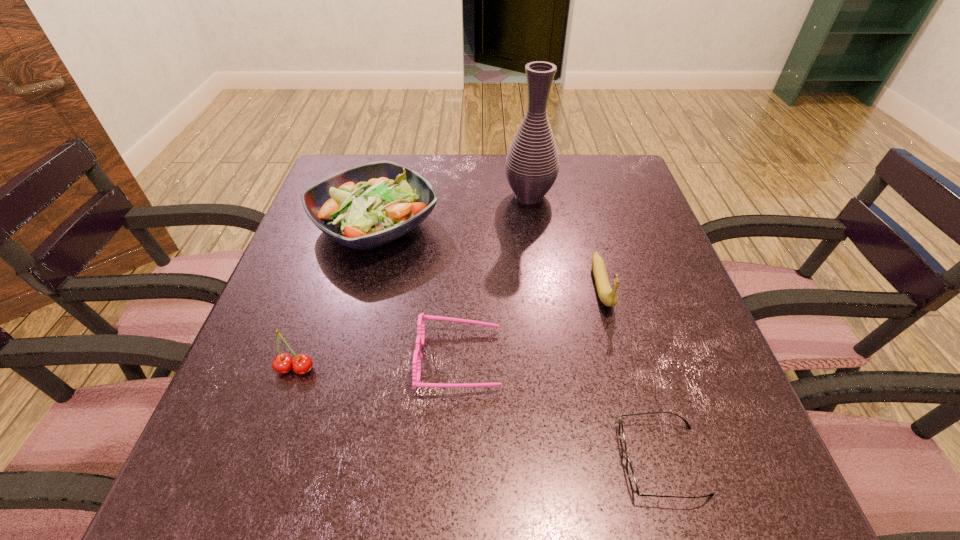
You are a GUI agent. You are given a task and a screenshot of the screen. Output one action in this format:
    pyautogui.click(x=<x>, y=<y>)
    Task: Click on the free space located 0.370m on the front of the salad plate
    Image resolution: width=960 pixels, height=540 pixels.
    Given the screenshot: What is the action you would take?
    pyautogui.click(x=319, y=434)

Identify the location of vacant area situated 0.300m at the stem of the banana. This screenshot has width=960, height=540. (652, 471).

Image resolution: width=960 pixels, height=540 pixels. I want to click on vacant region located with the stems of the cherry pointing upwards, so click(x=267, y=452).

Where is `free region located on the arms of the left spectacles`? The image size is (960, 540). free region located on the arms of the left spectacles is located at coordinates (529, 359).

Where is `vacant space situated on the front-facing side of the right spectacles`? This screenshot has width=960, height=540. vacant space situated on the front-facing side of the right spectacles is located at coordinates (422, 460).

At what (x,y) coordinates should I click in order to perform the action: click on free space located on the front-facing side of the right spectacles. Please return your answer as a coordinate pair (x, y). The height and width of the screenshot is (540, 960). Looking at the image, I should click on (548, 460).

Where is `vacant space located on the front-facing side of the right spectacles`? vacant space located on the front-facing side of the right spectacles is located at coordinates (402, 460).

Image resolution: width=960 pixels, height=540 pixels. I want to click on vase that is positioned at the far edge, so click(532, 164).

Where is `salad plate positioned at the far edge`? This screenshot has height=540, width=960. salad plate positioned at the far edge is located at coordinates (368, 205).

The height and width of the screenshot is (540, 960). I want to click on object located at the near edge, so click(630, 472).